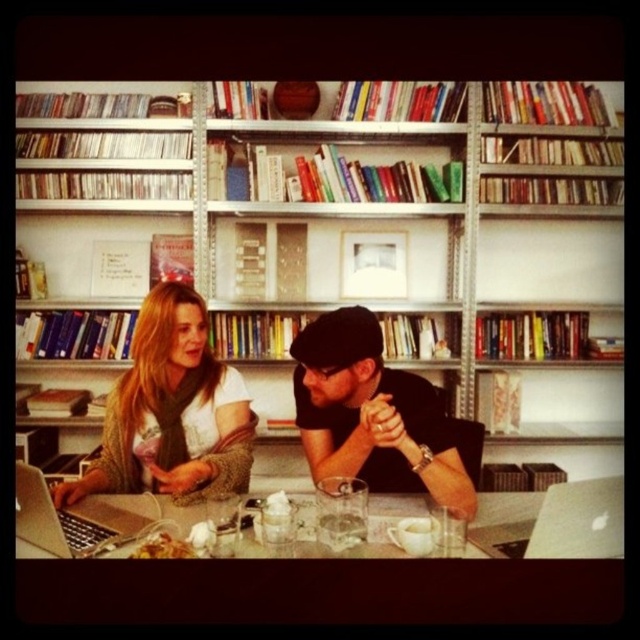
You are sitting at the wooden table at center and want to grab a book from the white wooden bookcase at upper center. Which direction should you move to reach it?

The white wooden bookcase at upper center is to the left of the wooden table at center, so you should move to your left to reach it.

You are a photographer trying to capture a candid shot of both individuals at the table. You notice two points of interest marked as point (531, 378) and point (492, 554). Which point should you focus on first to ensure both subjects are in sharp focus?

You should focus on point (531, 378) first because it is closer to the camera than point (492, 554), ensuring that both subjects will be in focus when using a shallow depth of field.

You are a customer in a store and want to place a small decorative item on the table between the white wooden bookcase at upper center and the black matte hat at center. Considering their sizes, which object should you place the item closer to?

Since the white wooden bookcase at upper center is larger in size than the black matte hat at center, you should place the item closer to the black matte hat at center to ensure there is enough space for both the item and the larger bookcase.